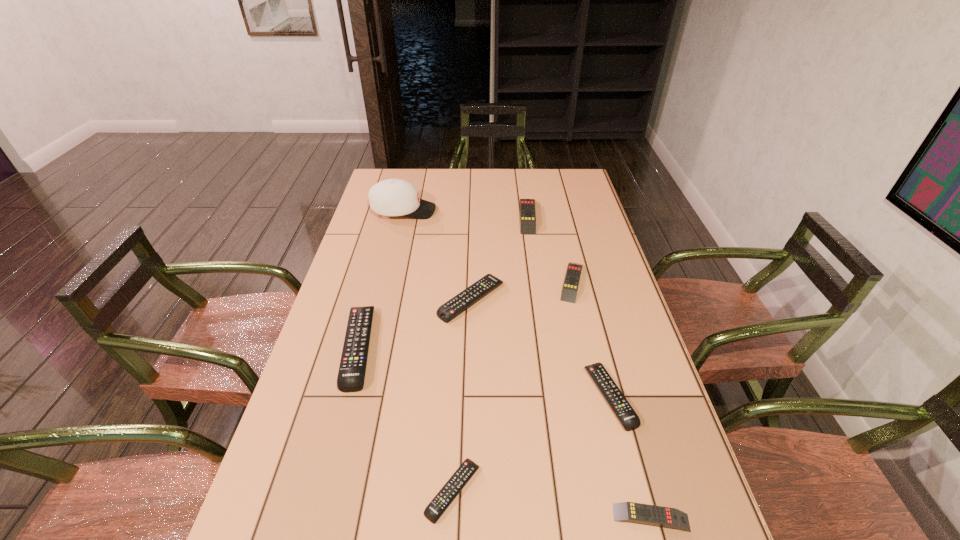
Find the location of `the shortest remote control`. the shortest remote control is located at coordinates (438, 505).

Image resolution: width=960 pixels, height=540 pixels. In order to click on the nearest black remote control in this screenshot , I will do `click(438, 505)`.

Where is `free space located on the front-facing side of the white baseball cap`? The width and height of the screenshot is (960, 540). free space located on the front-facing side of the white baseball cap is located at coordinates (449, 211).

Image resolution: width=960 pixels, height=540 pixels. Find the location of `vacant position located 0.070m on the left of the fourth remote control from left to right`. vacant position located 0.070m on the left of the fourth remote control from left to right is located at coordinates (499, 216).

Where is `free spot located on the back of the leftmost remote control`? The image size is (960, 540). free spot located on the back of the leftmost remote control is located at coordinates (384, 252).

This screenshot has height=540, width=960. In order to click on vacant space positioned on the left of the second farthest yellow remote control in this screenshot , I will do `click(470, 281)`.

You are a GUI agent. You are given a task and a screenshot of the screen. Output one action in this format:
    pyautogui.click(x=<x>, y=<y>)
    Task: Click on the free space located 0.210m on the right of the third smallest black remote control
    
    Given the screenshot: What is the action you would take?
    pyautogui.click(x=574, y=300)

The height and width of the screenshot is (540, 960). Identify the location of vacant space located 0.180m on the left of the rightmost black remote control. (516, 396).

Where is `vacant space situated on the left of the smallest yellow remote control`? vacant space situated on the left of the smallest yellow remote control is located at coordinates (413, 517).

The width and height of the screenshot is (960, 540). I want to click on vacant space located 0.100m on the left of the shortest remote control, so click(377, 490).